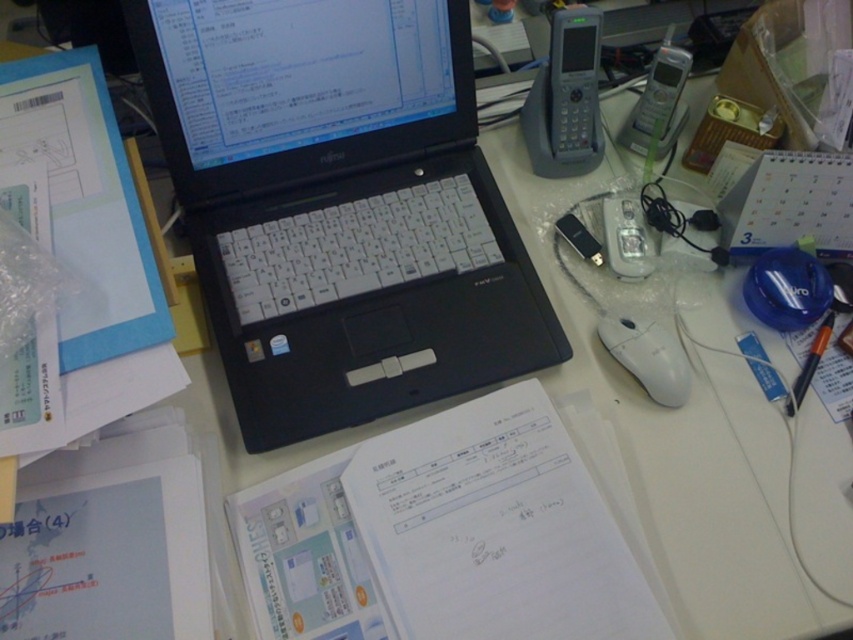
Can you confirm if black matte laptop at center is positioned below white matte mouse at center-right?

No.

Is point (364, 19) positioned before point (635, 376)?

Yes.

What do you see at coordinates (339, 205) in the screenshot? This screenshot has height=640, width=853. I see `black matte laptop at center` at bounding box center [339, 205].

Image resolution: width=853 pixels, height=640 pixels. Identify the location of black matte laptop at center. (339, 205).